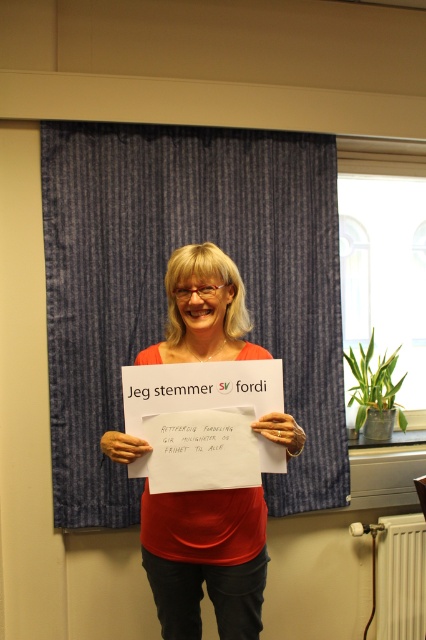
Question: Which of the following is the closest to the observer?

Choices:
 (A) tap(109, 177)
 (B) tap(224, 593)

Answer: (B)

Question: Among these objects, which one is nearest to the camera?

Choices:
 (A) matte paper sign at center
 (B) blue striped curtain at upper center

Answer: (A)

Question: Is blue striped curtain at upper center below matte paper sign at center?

Choices:
 (A) no
 (B) yes

Answer: (A)

Question: Is blue striped curtain at upper center thinner than matte paper sign at center?

Choices:
 (A) no
 (B) yes

Answer: (A)

Question: Can you confirm if blue striped curtain at upper center is thinner than matte paper sign at center?

Choices:
 (A) yes
 (B) no

Answer: (B)